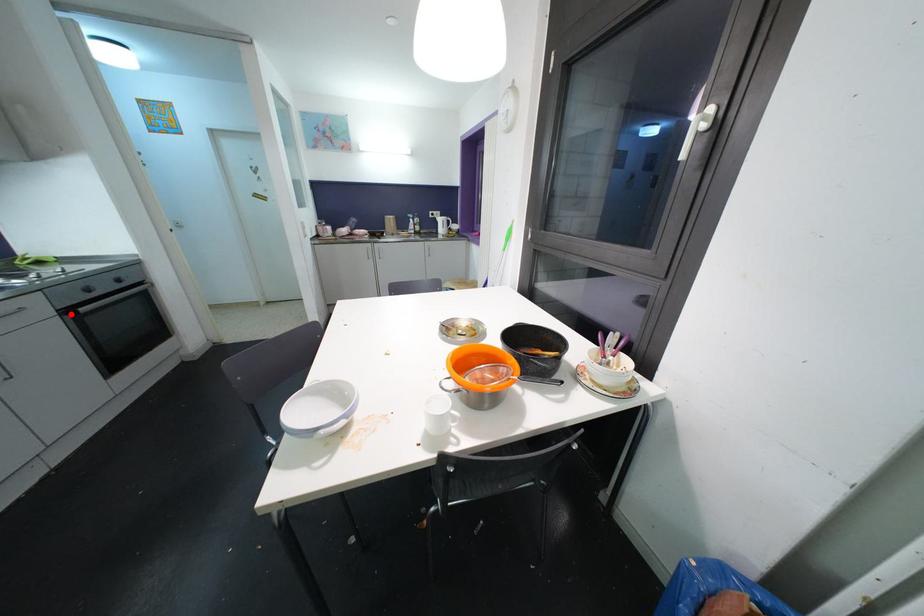
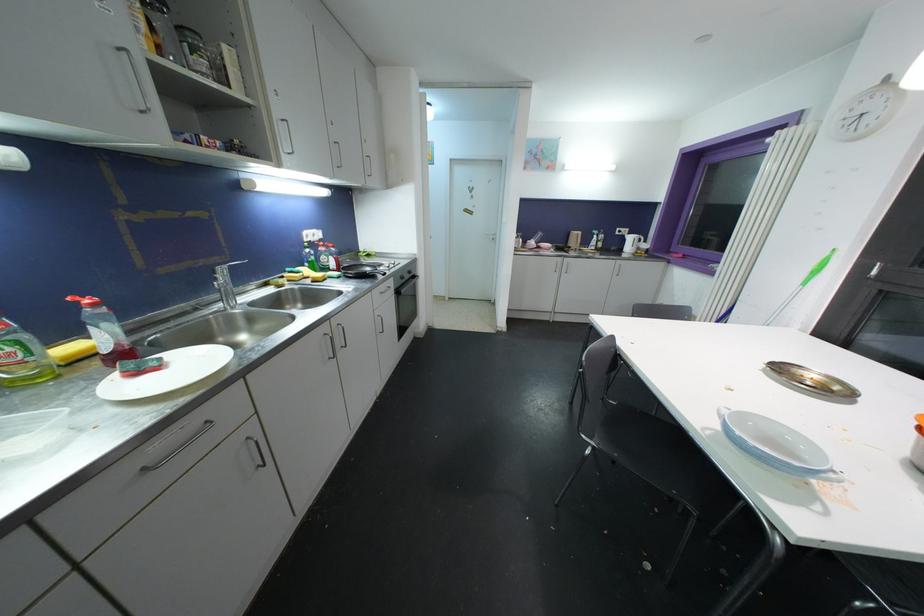
Question: I am providing you with two images of the same scene from different viewpoints. Given a red point in image1, look at the same physical point in image2. Is it:

Choices:
 (A) Closer to the viewpoint
 (B) Farther from the viewpoint

Answer: (A)